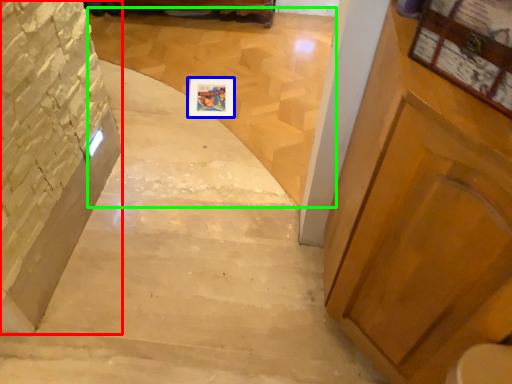
Question: Which object is the closest to the stairwell (highlighted by a red box)? Choose among these: picture frame (highlighted by a blue box) or stairwell (highlighted by a green box).

Choices:
 (A) picture frame
 (B) stairwell

Answer: (A)